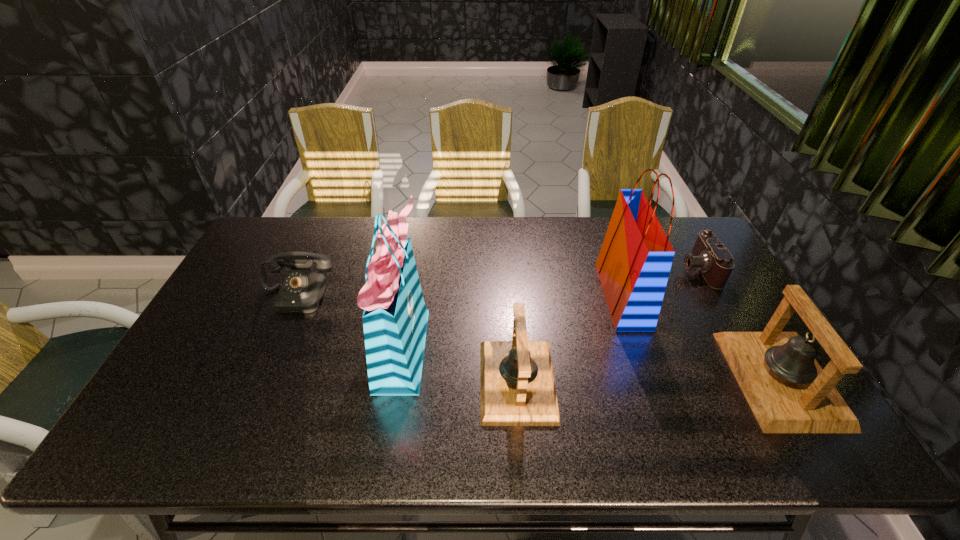
The width and height of the screenshot is (960, 540). In order to click on vacant space at the far right corner in this screenshot , I will do `click(694, 231)`.

I want to click on empty location between the shortest object and the left bell, so click(x=608, y=325).

Locate an element on the screen. This screenshot has width=960, height=540. free space between the telephone and the left shopping bag is located at coordinates (349, 321).

What are the coordinates of `vacant space that is in between the leftmost object and the taller bell` in the screenshot? It's located at (539, 338).

The image size is (960, 540). What are the coordinates of `free space between the third tallest object and the right shopping bag` in the screenshot? It's located at (701, 337).

Find the location of `vacant area between the second object from left to right and the taller bell`. vacant area between the second object from left to right and the taller bell is located at coordinates (591, 363).

What are the coordinates of `free space between the left shopping bag and the telephone` in the screenshot? It's located at (349, 321).

Identify the location of unoccupied area between the camera and the fifth tallest object. (497, 282).

Image resolution: width=960 pixels, height=540 pixels. Find the location of `vacant region between the fourth object from left to right and the left shopping bag`. vacant region between the fourth object from left to right and the left shopping bag is located at coordinates (513, 321).

Image resolution: width=960 pixels, height=540 pixels. In order to click on vacant space that's between the shortest object and the shorter bell in this screenshot , I will do `click(608, 325)`.